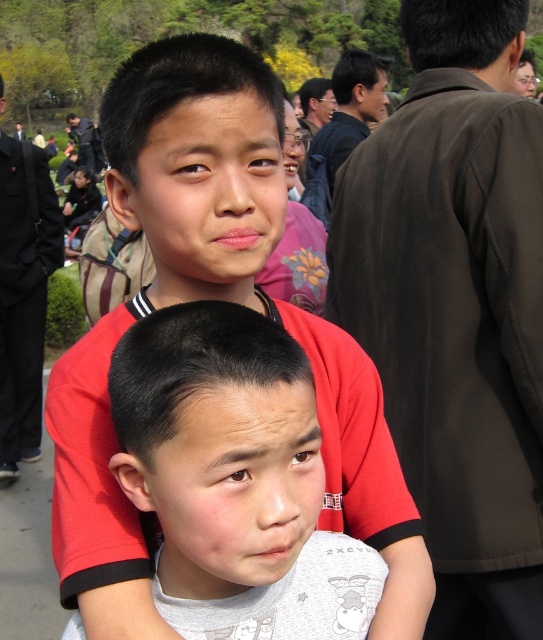
Question: Which object is farther from the camera taking this photo?

Choices:
 (A) gray cotton shirt at center
 (B) brown fabric shoulder at upper right

Answer: (B)

Question: Which object appears farthest from the camera in this image?

Choices:
 (A) matte red shirt at center
 (B) brown fabric shoulder at upper right
 (C) gray cotton shirt at center

Answer: (B)

Question: Does brown fabric shoulder at upper right appear over gray cotton shirt at center?

Choices:
 (A) no
 (B) yes

Answer: (B)

Question: Which point is closer to the camera?

Choices:
 (A) (371, 397)
 (B) (419, 77)
 (C) (244, 522)

Answer: (C)

Question: Does brown fabric shoulder at upper right appear over matte red shirt at center?

Choices:
 (A) no
 (B) yes

Answer: (A)

Question: Can you confirm if brown fabric shoulder at upper right is positioned to the right of matte red shirt at center?

Choices:
 (A) yes
 (B) no

Answer: (A)